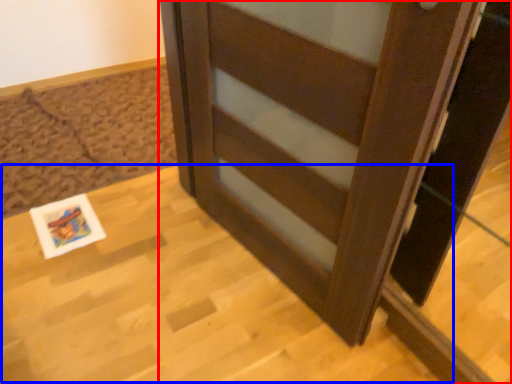
Question: Which object appears closest to the camera in this image, furniture (highlighted by a red box) or table (highlighted by a blue box)?

Choices:
 (A) furniture
 (B) table

Answer: (A)